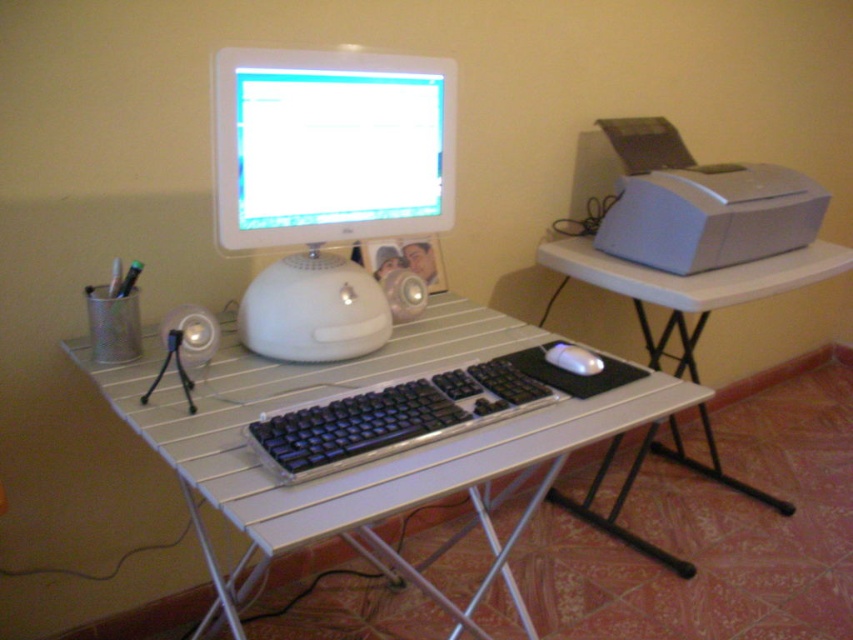
You are organizing your workspace and need to place a new large printer. The metallic silver computer desk at center and the white glossy monitor at center are in your way. Which object should you move to make space for the printer?

The metallic silver computer desk at center is bigger than the white glossy monitor at center, so you should move the metallic silver computer desk at center to make space for the printer since it occupies more area.

From the picture: You are setting up a new wireless keyboard that requires a 12 inch minimum distance between the keyboard and the monitor to function properly. You have the metallic silver computer desk at center and the white glossy monitor at center. Can the keyboard be placed between them to meet this requirement?

The metallic silver computer desk at center and white glossy monitor at center are 11.86 inches apart from each other. Since the required minimum distance is 12 inches, the keyboard cannot be placed between them as the current spacing is insufficient.

You are organizing the desk and want to place a new item between the white glossy monitor at center and the satin silver printer at right. Is there enough space between them for a 10 cm wide object?

The white glossy monitor at center is to the left of the satin silver printer at right, so there is space between them. Since the object is only 10 cm wide, it should fit between them.